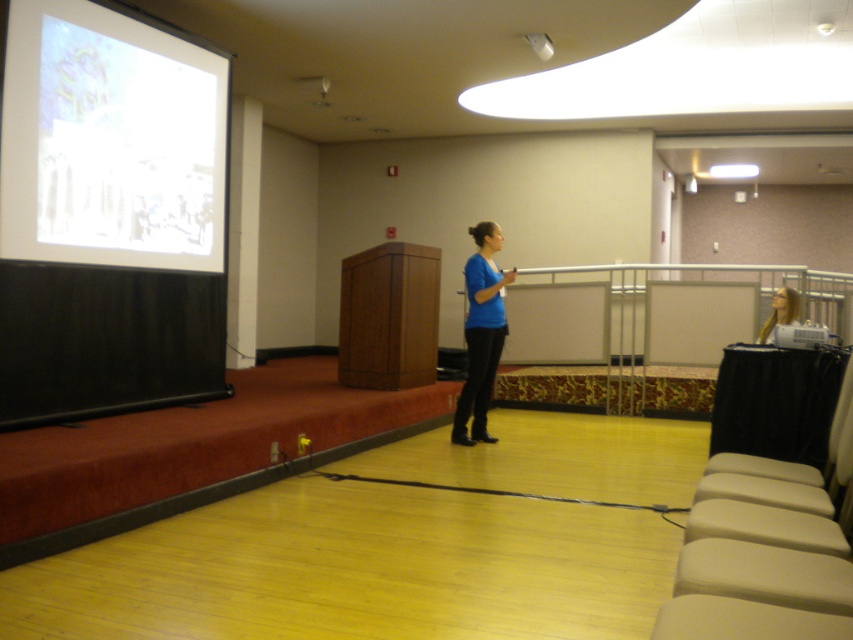
Question: Is blue matte shirt at center closer to camera compared to metallic gray projector at lower right?

Choices:
 (A) no
 (B) yes

Answer: (A)

Question: Which of the following is the farthest from the observer?

Choices:
 (A) white glossy projection screen at upper left
 (B) blue matte shirt at center

Answer: (B)

Question: Which object is the closest to the blue matte shirt at center?

Choices:
 (A) metallic gray projector at lower right
 (B) blonde hair at upper right
 (C) white glossy projection screen at upper left

Answer: (A)

Question: Which is farther from the blonde hair at upper right?

Choices:
 (A) blue matte shirt at center
 (B) metallic gray projector at lower right

Answer: (A)

Question: Is white glossy projection screen at upper left closer to camera compared to blonde hair at upper right?

Choices:
 (A) yes
 (B) no

Answer: (A)

Question: Does blonde hair at upper right appear on the right side of metallic gray projector at lower right?

Choices:
 (A) no
 (B) yes

Answer: (B)